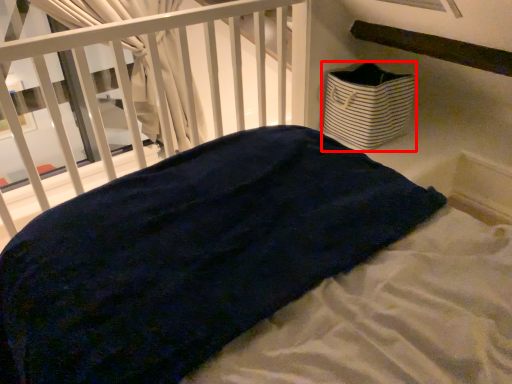
Question: From the image's perspective, considering the relative positions of basket (annotated by the red box) and infant bed in the image provided, where is basket (annotated by the red box) located with respect to the staircase?

Choices:
 (A) below
 (B) above

Answer: (B)